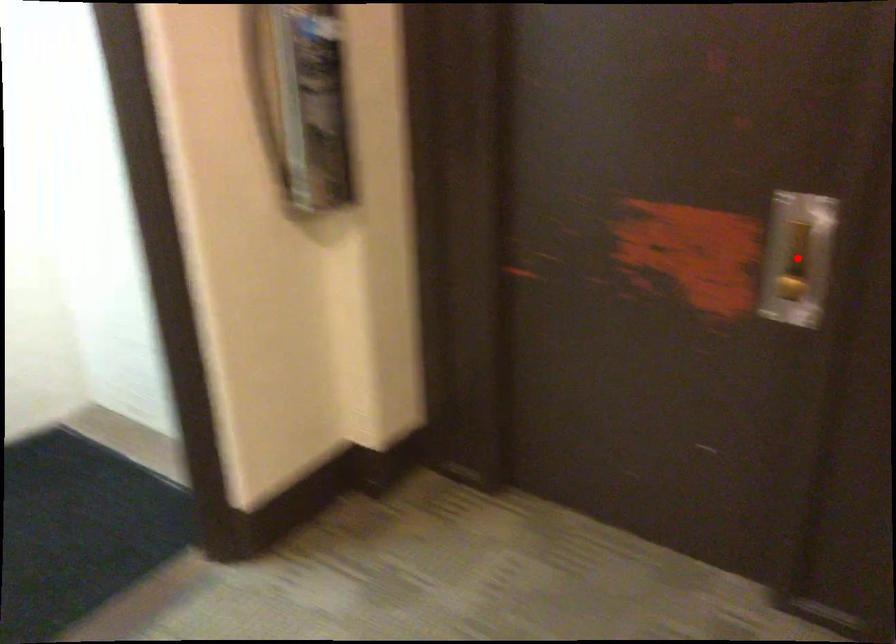
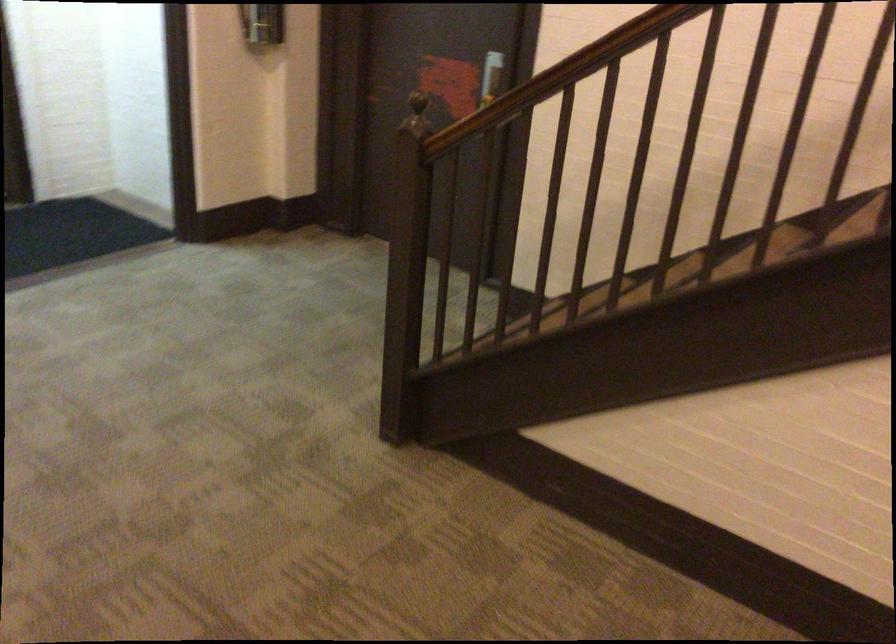
Question: I am providing you with two images of the same scene from different viewpoints. A red point is marked on the first image. Is the red point's position out of view in image 2?

Choices:
 (A) Yes
 (B) No

Answer: (A)